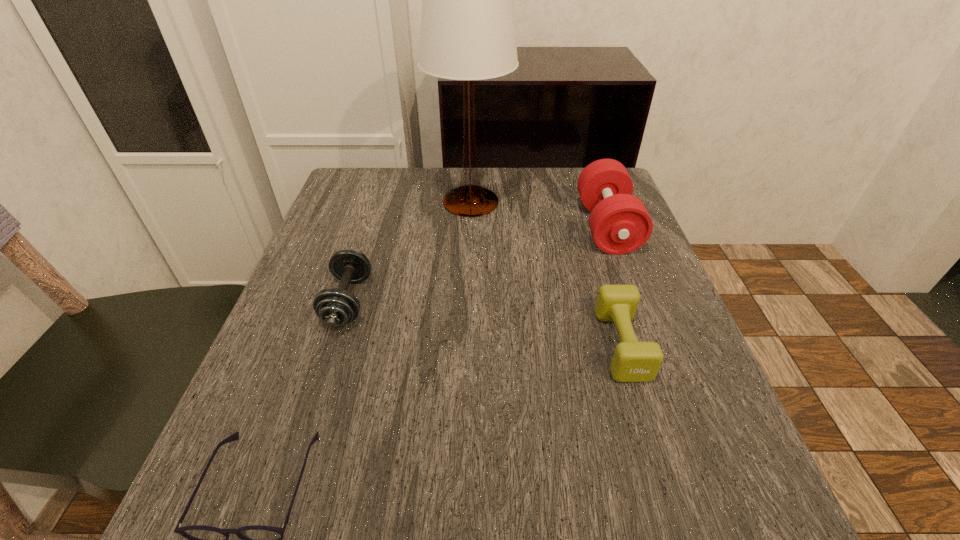
This screenshot has width=960, height=540. Identify the location of object that is at the left edge. (x=335, y=307).

Identify the location of object present at the far right corner. The image size is (960, 540). point(619,222).

This screenshot has width=960, height=540. In the image, there is a desktop. What are the coordinates of `free space at the far edge` in the screenshot? It's located at (514, 178).

Locate an element on the screen. The width and height of the screenshot is (960, 540). vacant space at the near edge of the desktop is located at coordinates [x=420, y=515].

In order to click on free location at the left edge in this screenshot , I will do `click(351, 368)`.

The height and width of the screenshot is (540, 960). I want to click on vacant area at the right edge, so click(x=640, y=460).

Locate an element on the screen. free space at the far left corner of the desktop is located at coordinates (340, 215).

Find the location of `vacant space at the near left corner of the desktop`. vacant space at the near left corner of the desktop is located at coordinates (303, 504).

Locate an element on the screen. Image resolution: width=960 pixels, height=540 pixels. free space between the table lamp and the leftmost dumbbell is located at coordinates (409, 252).

The width and height of the screenshot is (960, 540). Find the location of `vacant space in between the leftmost dumbbell and the table lamp`. vacant space in between the leftmost dumbbell and the table lamp is located at coordinates (409, 252).